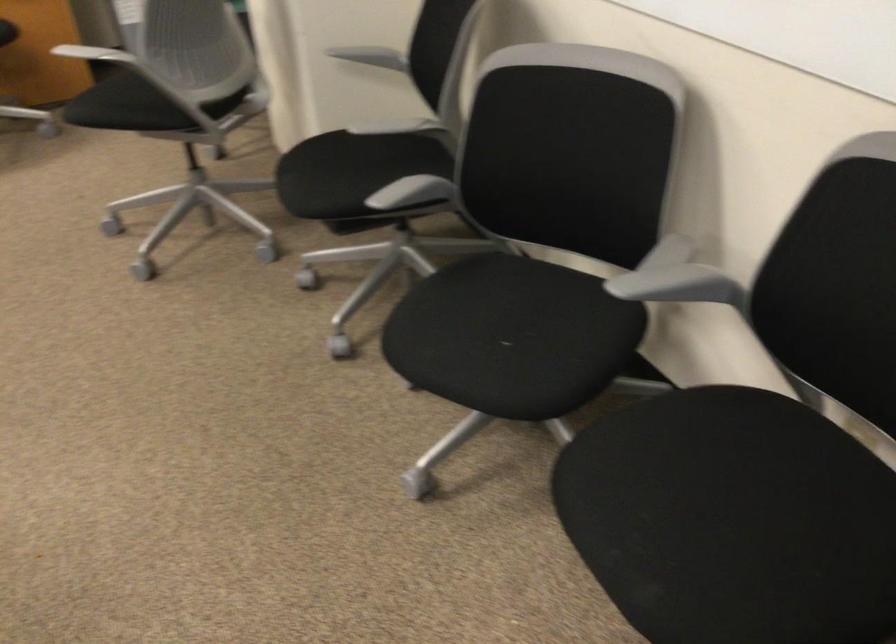
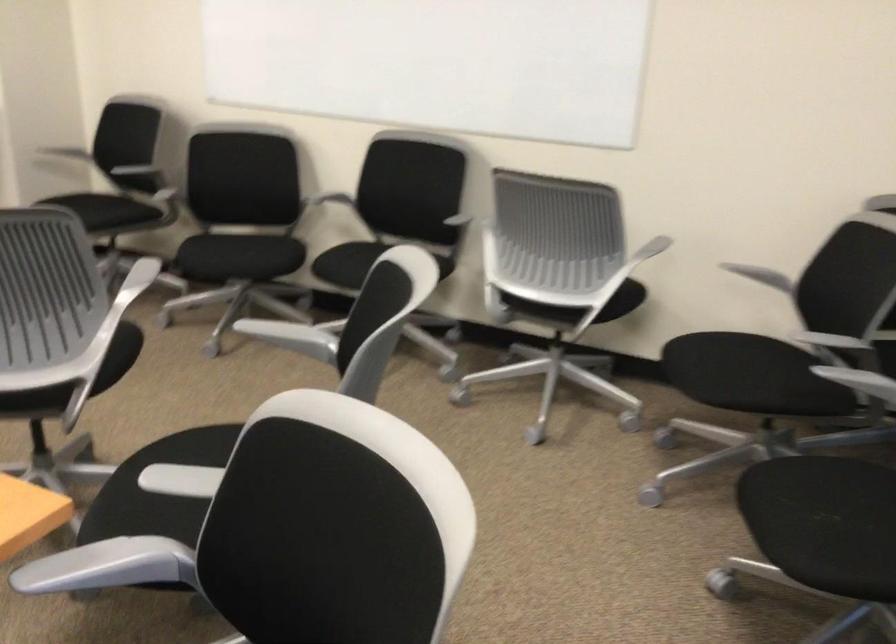
Find the pixel in the second image that matches (476,346) in the first image.

(237, 257)